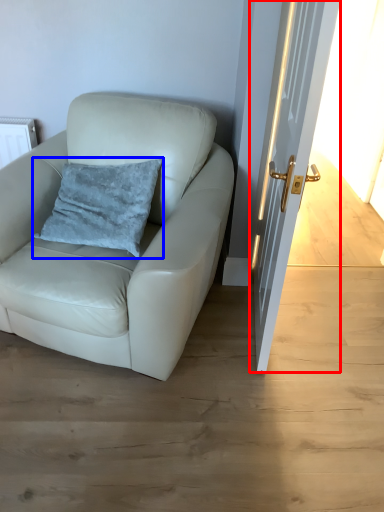
Question: Which object is closer to the camera taking this photo, door (highlighted by a red box) or pillow (highlighted by a blue box)?

Choices:
 (A) door
 (B) pillow

Answer: (A)